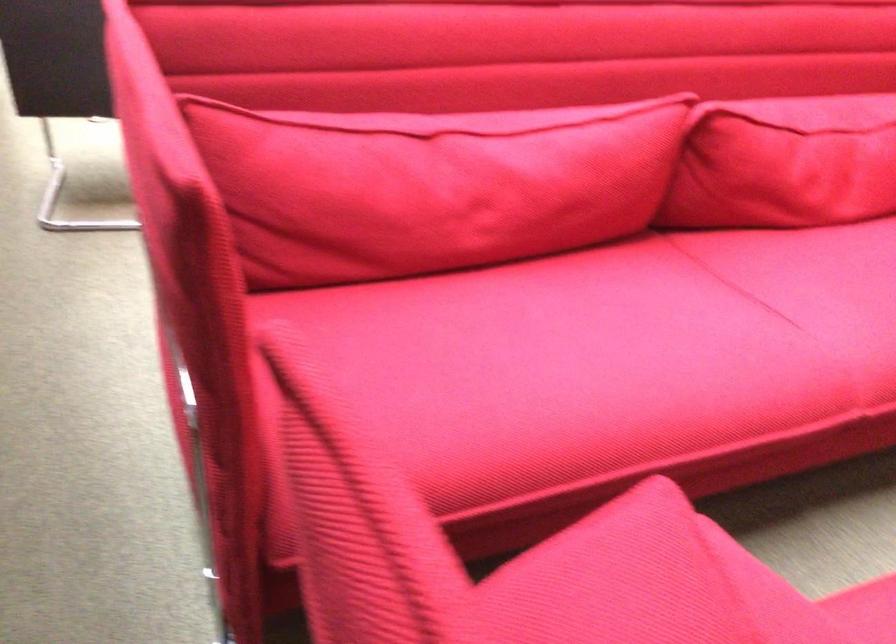
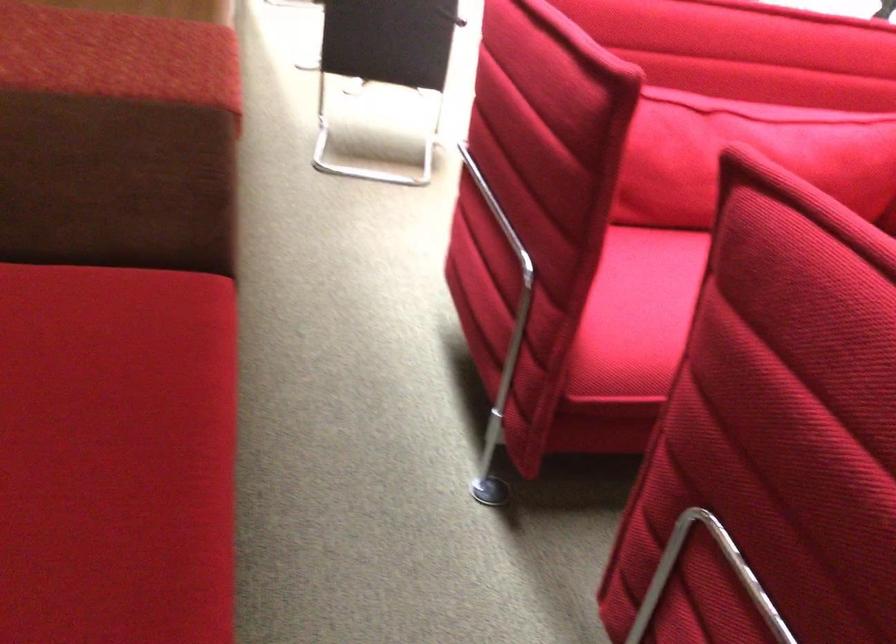
Which direction would the cameraman need to move to produce the second image?

The movement direction of the cameraman is left, backward.